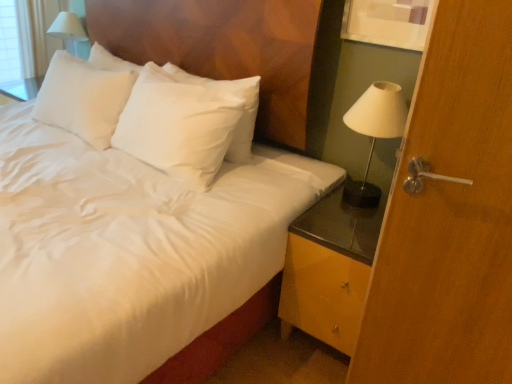
Question: In the image, is yellow glossy nightstand at lower right positioned in front of or behind white glossy lamp at right?

Choices:
 (A) behind
 (B) front

Answer: (B)

Question: Is point (293, 251) positioned closer to the camera than point (397, 84)?

Choices:
 (A) closer
 (B) farther

Answer: (A)

Question: Estimate the real-world distances between objects in this image. Which object is farther from the wooden door handle at right?

Choices:
 (A) yellow glossy nightstand at lower right
 (B) white glossy lamp at right
 (C) white satin pillow at upper center
 (D) white satin bed at center
 (E) white glossy table lamp at upper left

Answer: (E)

Question: Considering the real-world distances, which object is closest to the yellow glossy nightstand at lower right?

Choices:
 (A) white glossy table lamp at upper left
 (B) wooden door handle at right
 (C) white satin pillow at upper center
 (D) white satin bed at center
 (E) white glossy lamp at right

Answer: (B)